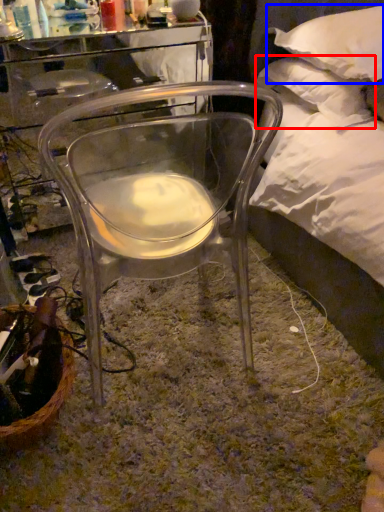
Question: Which object appears farthest to the camera in this image, pillow (highlighted by a red box) or pillow (highlighted by a blue box)?

Choices:
 (A) pillow
 (B) pillow

Answer: (A)